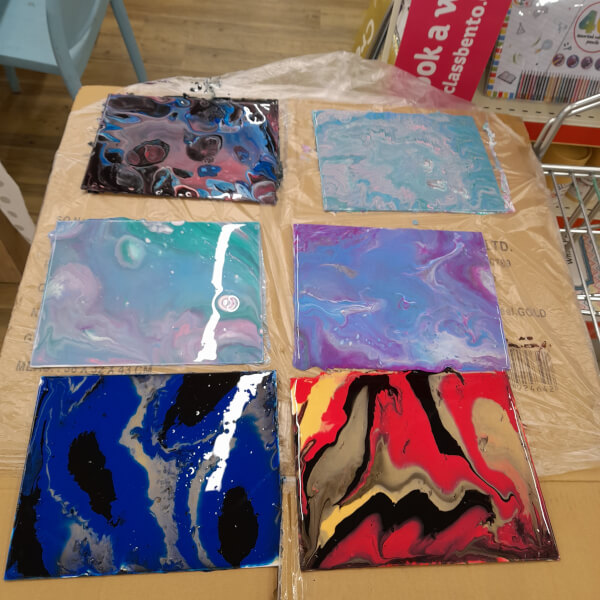
Identify the location of purple paint. The width and height of the screenshot is (600, 600). click(402, 292).